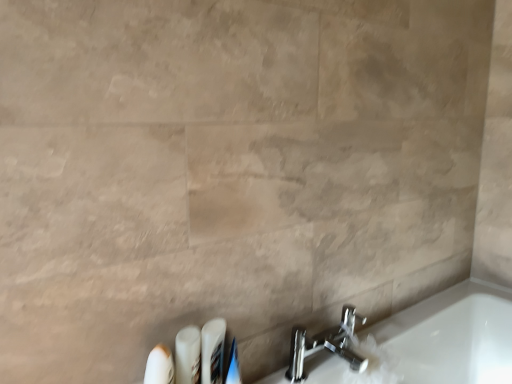
Question: Does polished chrome faucet at lower right have a larger size compared to white plastic toothbrush at lower left, the 4th toiletry from the right?

Choices:
 (A) yes
 (B) no

Answer: (A)

Question: Considering the relative sizes of polished chrome faucet at lower right and white plastic toothbrush at lower left, the 4th toiletry from the right, in the image provided, is polished chrome faucet at lower right shorter than white plastic toothbrush at lower left, the 4th toiletry from the right,?

Choices:
 (A) yes
 (B) no

Answer: (A)

Question: Does polished chrome faucet at lower right appear on the left side of white plastic toothbrush at lower left, the 4th toiletry from the right?

Choices:
 (A) yes
 (B) no

Answer: (B)

Question: Does polished chrome faucet at lower right have a lesser width compared to white plastic toothbrush at lower left, the first toiletry from the left?

Choices:
 (A) no
 (B) yes

Answer: (A)

Question: Would you say polished chrome faucet at lower right contains white plastic toothbrush at lower left, the first toiletry from the left?

Choices:
 (A) yes
 (B) no

Answer: (B)

Question: Would you say white plastic toothbrushes at lower center, the third toiletry positioned from the left, is inside or outside white plastic toothbrush at lower left, the 4th toiletry from the right?

Choices:
 (A) outside
 (B) inside

Answer: (A)

Question: From a real-world perspective, relative to white plastic toothbrush at lower left, the 4th toiletry from the right, is white plastic toothbrushes at lower center, the second toiletry from the right, vertically above or below?

Choices:
 (A) above
 (B) below

Answer: (B)

Question: Visually, is white plastic toothbrushes at lower center, the second toiletry from the right, positioned to the left or to the right of white plastic toothbrush at lower left, the 4th toiletry from the right?

Choices:
 (A) left
 (B) right

Answer: (B)

Question: In terms of size, does white plastic toothbrushes at lower center, the second toiletry from the right, appear bigger or smaller than white plastic toothbrush at lower left, the 4th toiletry from the right?

Choices:
 (A) big
 (B) small

Answer: (B)

Question: From a real-world perspective, is white glossy toothpaste at lower center, which appears as the 4th toiletry when viewed from the left, above or below polished chrome faucet at lower right?

Choices:
 (A) above
 (B) below

Answer: (A)

Question: Is point (233, 382) closer or farther from the camera than point (288, 365)?

Choices:
 (A) farther
 (B) closer

Answer: (B)

Question: In the image, is white glossy toothpaste at lower center, which is the 1th toiletry in right-to-left order, positioned in front of or behind polished chrome faucet at lower right?

Choices:
 (A) front
 (B) behind

Answer: (A)

Question: In terms of height, does white glossy toothpaste at lower center, which is the 1th toiletry in right-to-left order, look taller or shorter compared to polished chrome faucet at lower right?

Choices:
 (A) short
 (B) tall

Answer: (B)

Question: Would you say white plastic toothbrushes at lower center, the second toiletry from the right, is inside or outside white glossy toothpaste at lower center, which is the 1th toiletry in right-to-left order?

Choices:
 (A) outside
 (B) inside

Answer: (A)

Question: Considering the positions of white plastic toothbrushes at lower center, the third toiletry positioned from the left, and white glossy toothpaste at lower center, which is the 1th toiletry in right-to-left order, in the image, is white plastic toothbrushes at lower center, the third toiletry positioned from the left, taller or shorter than white glossy toothpaste at lower center, which is the 1th toiletry in right-to-left order,?

Choices:
 (A) tall
 (B) short

Answer: (A)